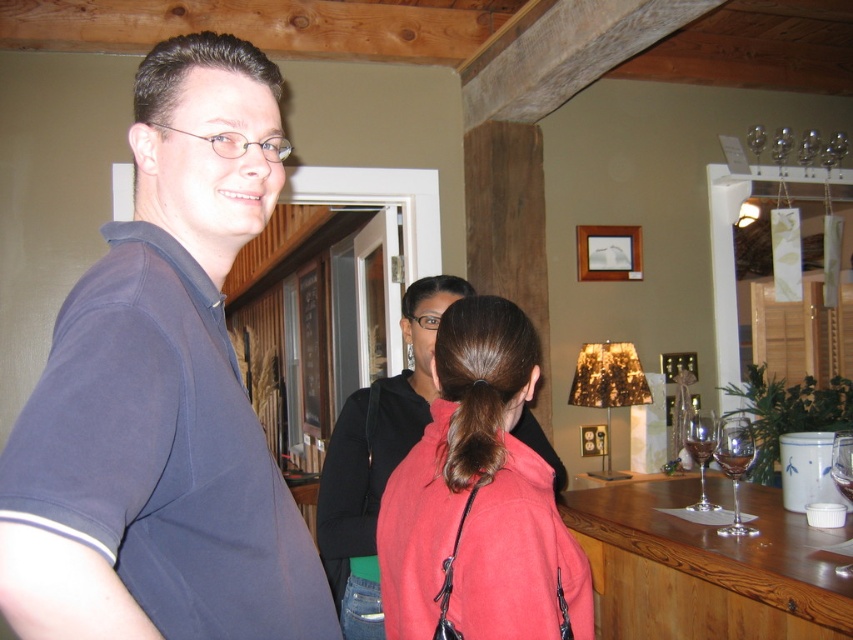
Can you confirm if dark blue shirt at center is bigger than brown silky hair at center?

Yes.

Can you confirm if dark blue shirt at center is smaller than brown silky hair at center?

No.

This screenshot has width=853, height=640. What do you see at coordinates (163, 396) in the screenshot?
I see `dark blue shirt at center` at bounding box center [163, 396].

Identify the location of dark blue shirt at center. (163, 396).

Can you confirm if matte red sweater at center is positioned below brown silky hair at center?

Correct, matte red sweater at center is located below brown silky hair at center.

Between matte red sweater at center and brown silky hair at center, which one is positioned higher?

brown silky hair at center is above.

Locate an element on the screen. Image resolution: width=853 pixels, height=640 pixels. matte red sweater at center is located at coordinates (479, 499).

Where is `matte red sweater at center`? matte red sweater at center is located at coordinates coord(479,499).

Who is positioned more to the right, dark blue shirt at center or matte red sweater at center?

matte red sweater at center

Who is more distant from viewer, (x=268, y=147) or (x=432, y=604)?

The point (x=432, y=604) is behind.

The image size is (853, 640). Find the location of `dark blue shirt at center`. dark blue shirt at center is located at coordinates (163, 396).